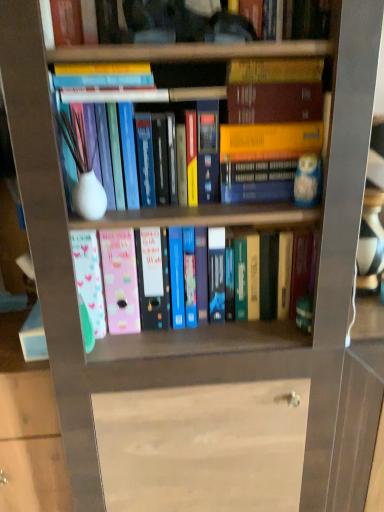
Question: From the image's perspective, is hardcover book at upper center, marked as the second book in a top-to-bottom arrangement, above or below hardcover book at upper center, which is counted as the 4th book, starting from the bottom?

Choices:
 (A) above
 (B) below

Answer: (B)

Question: From a real-world perspective, is hardcover book at upper center, arranged as the 3th book when ordered from the bottom, positioned above or below hardcover book at upper center, placed as the first book when sorted from top to bottom?

Choices:
 (A) above
 (B) below

Answer: (B)

Question: Which object is positioned farthest from the pastel plastic folders at center, the fourth book in the top-to-bottom sequence?

Choices:
 (A) hardcover book at upper center, arranged as the 3th book when ordered from the bottom
 (B) hardcover book at upper center, which is counted as the 4th book, starting from the bottom
 (C) matte white vase at center, the third book when ordered from top to bottom

Answer: (B)

Question: Based on their relative distances, which object is farther from the hardcover book at upper center, placed as the first book when sorted from top to bottom?

Choices:
 (A) hardcover book at upper center, marked as the second book in a top-to-bottom arrangement
 (B) matte white vase at center, the third book when ordered from top to bottom
 (C) pastel plastic folders at center, which is the 1th book in bottom-to-top order

Answer: (C)